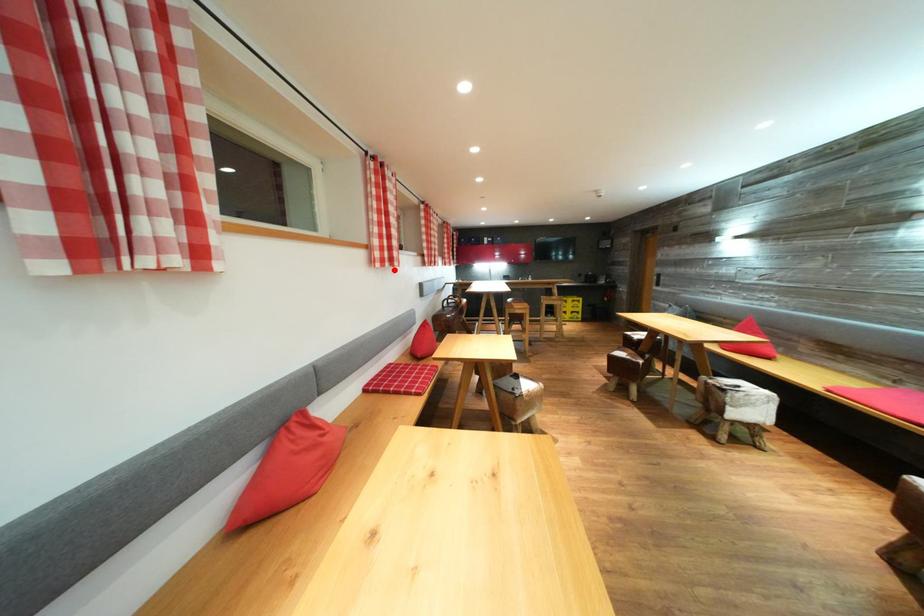
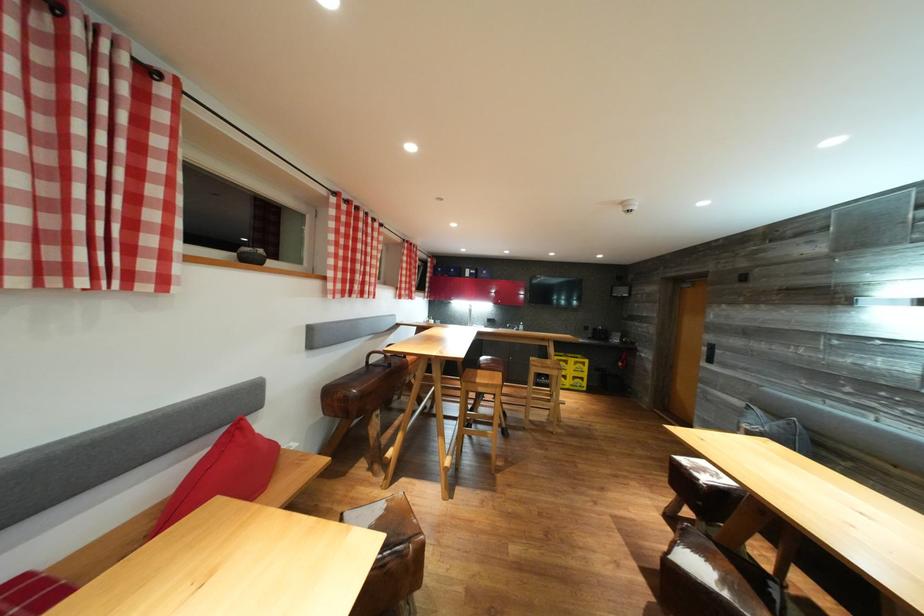
Question: I am providing you with two images of the same scene from different viewpoints. Given a red point in image1, look at the same physical point in image2. Is it:

Choices:
 (A) Closer to the viewpoint
 (B) Farther from the viewpoint

Answer: (B)